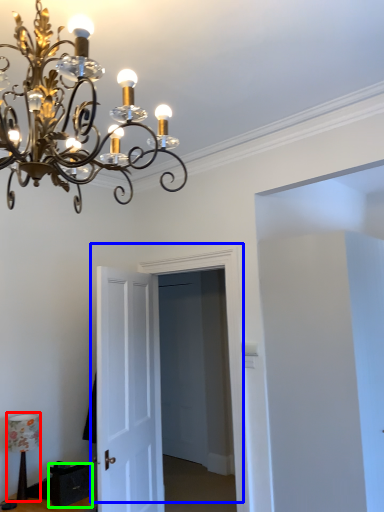
Question: Which is farther away from lamp (highlighted by a red box)? door (highlighted by a blue box) or drawer (highlighted by a green box)?

Choices:
 (A) door
 (B) drawer

Answer: (A)